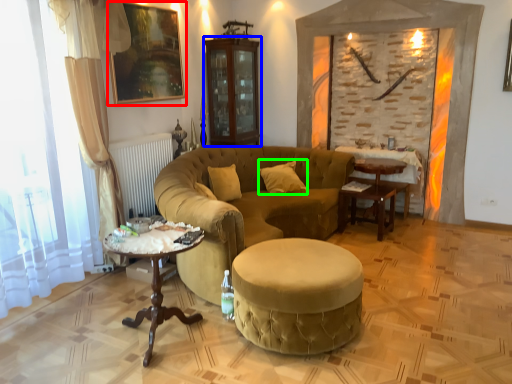
Question: Which object is positioned closest to picture frame (highlighted by a red box)? Select from armoire (highlighted by a blue box) and pillow (highlighted by a green box).

Choices:
 (A) armoire
 (B) pillow

Answer: (A)